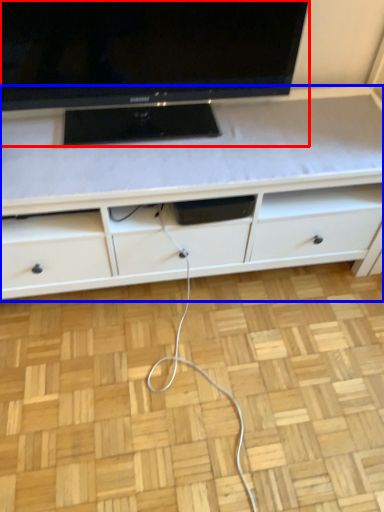
Question: Which point is closer to the camera, television (highlighted by a red box) or cabinetry (highlighted by a blue box)?

Choices:
 (A) television
 (B) cabinetry

Answer: (A)